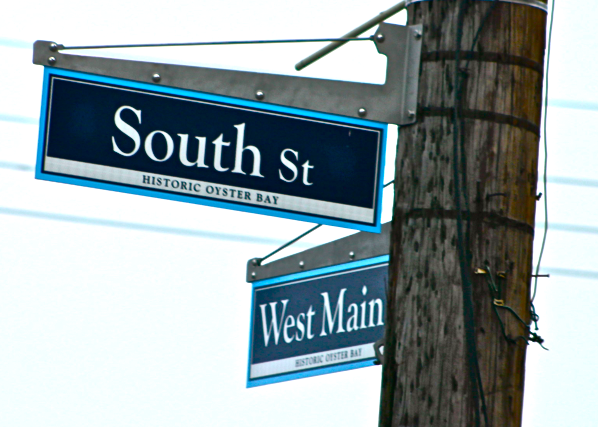
The width and height of the screenshot is (598, 427). What are the coordinates of `cable` in the screenshot? It's located at (469, 219).